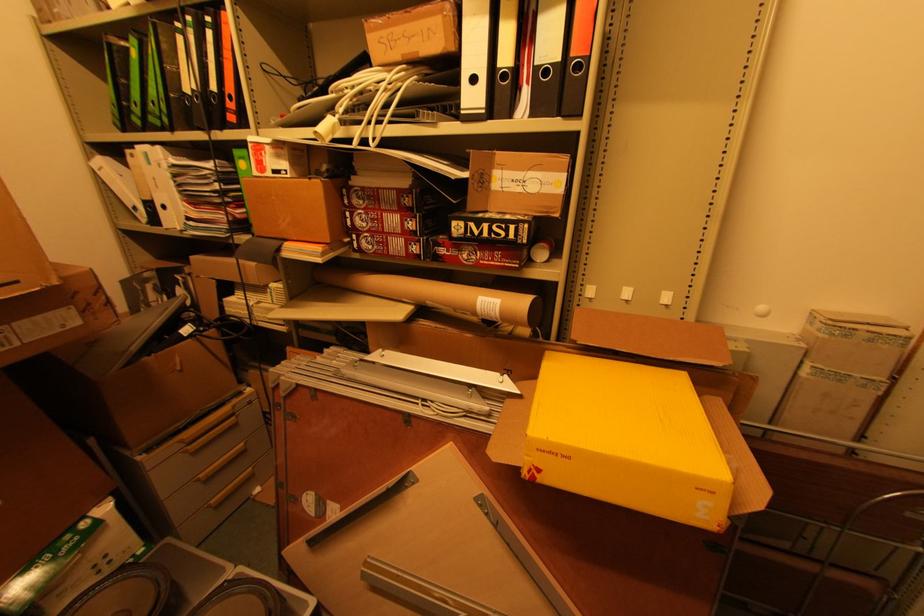
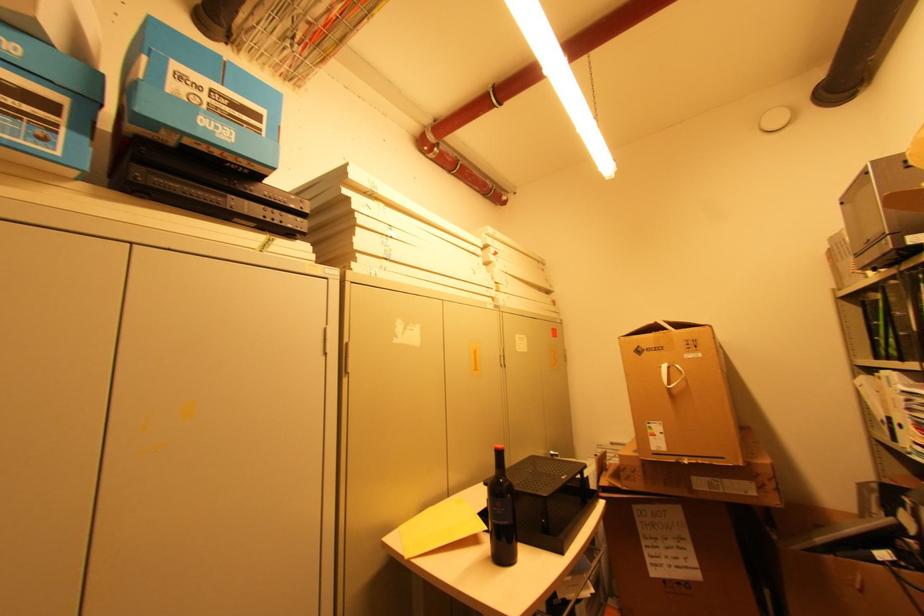
The point at (x=168, y=61) is marked in the first image. Where is the corresponding point in the second image?

(896, 310)